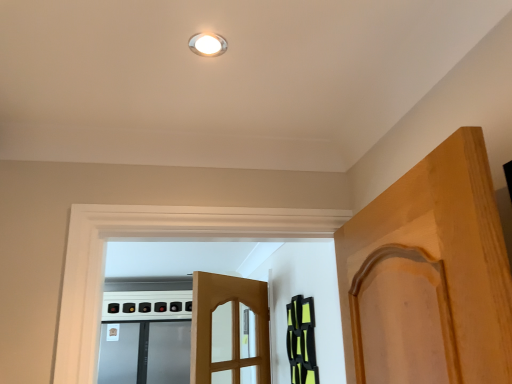
Question: Is black matte cabinet at right to the left or to the right of satin silver screen door at lower left in the image?

Choices:
 (A) right
 (B) left

Answer: (A)

Question: In terms of size, does black matte cabinet at right appear bigger or smaller than satin silver screen door at lower left?

Choices:
 (A) small
 (B) big

Answer: (A)

Question: Which object is the closest to the black matte cabinet at right?

Choices:
 (A) white glossy light fixture at upper center
 (B) satin silver screen door at lower left

Answer: (A)

Question: Which object is positioned closest to the satin silver screen door at lower left?

Choices:
 (A) white glossy light fixture at upper center
 (B) black matte cabinet at right

Answer: (B)